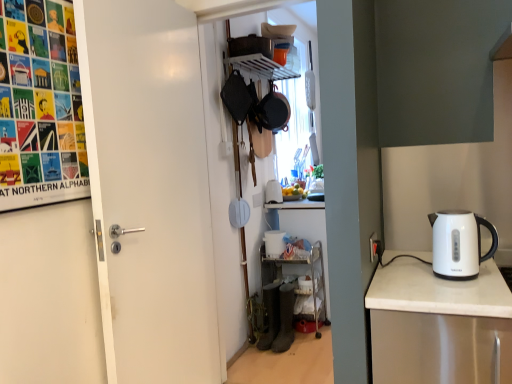
Question: Considering the positions of point (280, 297) and point (248, 61), is point (280, 297) closer or farther from the camera than point (248, 61)?

Choices:
 (A) closer
 (B) farther

Answer: (B)

Question: Considering the positions of matte black kettle at lower center, the 1th appliance when ordered from bottom to top, and white plastic shelf at upper center, the 1th shelf from the top, in the image, is matte black kettle at lower center, the 1th appliance when ordered from bottom to top, wider or thinner than white plastic shelf at upper center, the 1th shelf from the top,?

Choices:
 (A) wide
 (B) thin

Answer: (B)

Question: Based on their relative distances, which object is nearer to the white plastic shelf at upper center, marked as the second shelf in a bottom-to-top arrangement?

Choices:
 (A) white matte door at left
 (B) multicolored paper poster at upper left
 (C) white glossy electric kettle at right
 (D) matte black frying pan at upper center
 (E) matte black kettle at lower center, placed as the 1th appliance when sorted from front to back

Answer: (D)

Question: Which is nearer to the white glossy electric kettle at right?

Choices:
 (A) white plastic bucket at lower center, acting as the 2th appliance starting from the front
 (B) multicolored paper poster at upper left
 (C) matte black frying pan at upper center
 (D) matte black kettle at lower center, placed as the 1th appliance when sorted from front to back
 (E) metallic silver shelf at lower center, which is counted as the 2th shelf, starting from the top

Answer: (B)